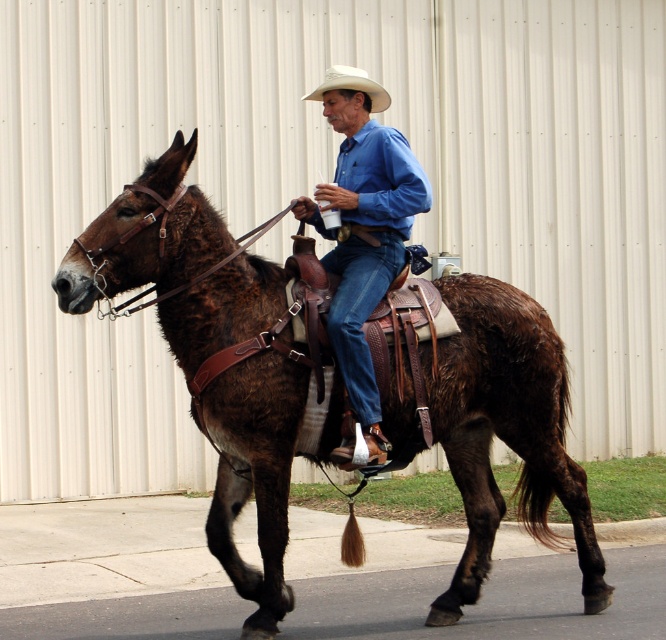
Question: Is blue denim jeans at center behind white matte cowboy hat at center?

Choices:
 (A) no
 (B) yes

Answer: (A)

Question: Which point appears farthest from the camera in this image?

Choices:
 (A) (334, 83)
 (B) (356, 417)

Answer: (A)

Question: Among these objects, which one is farthest from the camera?

Choices:
 (A) blue denim jeans at center
 (B) white matte cowboy hat at center
 (C) brown leather horse at center

Answer: (B)

Question: Which is farther from the brown leather horse at center?

Choices:
 (A) blue denim jeans at center
 (B) white matte cowboy hat at center

Answer: (B)

Question: Is blue denim jeans at center bigger than white matte cowboy hat at center?

Choices:
 (A) yes
 (B) no

Answer: (A)

Question: Considering the relative positions of blue denim jeans at center and white matte cowboy hat at center in the image provided, where is blue denim jeans at center located with respect to white matte cowboy hat at center?

Choices:
 (A) left
 (B) right

Answer: (B)